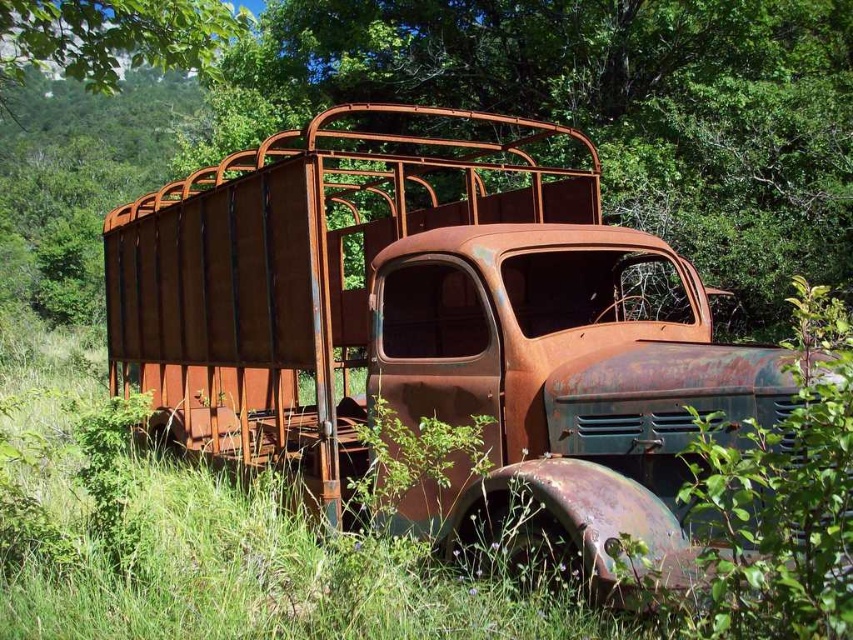
Question: Which point is closer to the camera?

Choices:
 (A) rusty metal trailer truck at center
 (B) rusty metal truck at center

Answer: (B)

Question: Can you confirm if rusty metal trailer truck at center is positioned below rusty metal truck at center?

Choices:
 (A) yes
 (B) no

Answer: (A)

Question: Which of the following is the farthest from the observer?

Choices:
 (A) (184, 195)
 (B) (723, 154)

Answer: (B)

Question: Can you confirm if rusty metal trailer truck at center is positioned to the left of rusty metal truck at center?

Choices:
 (A) yes
 (B) no

Answer: (B)

Question: Does rusty metal trailer truck at center have a smaller size compared to rusty metal truck at center?

Choices:
 (A) yes
 (B) no

Answer: (A)